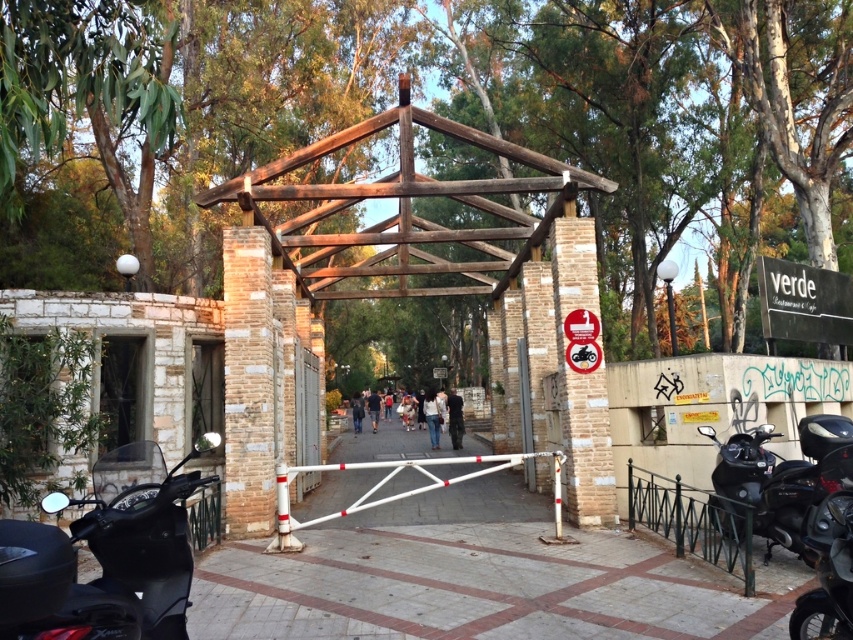
Does black matte motorcycle at lower left have a lesser height compared to shiny black motorcycle at lower right?

No, black matte motorcycle at lower left is not shorter than shiny black motorcycle at lower right.

Does black matte motorcycle at lower left have a larger size compared to shiny black motorcycle at lower right?

Yes, black matte motorcycle at lower left is bigger than shiny black motorcycle at lower right.

Image resolution: width=853 pixels, height=640 pixels. What do you see at coordinates (103, 560) in the screenshot?
I see `black matte motorcycle at lower left` at bounding box center [103, 560].

The width and height of the screenshot is (853, 640). In order to click on black matte motorcycle at lower left in this screenshot , I will do `click(103, 560)`.

Can you confirm if black matte motorcycle at lower left is taller than black glossy motorcycle at lower right?

In fact, black matte motorcycle at lower left may be shorter than black glossy motorcycle at lower right.

Who is higher up, black matte motorcycle at lower left or black glossy motorcycle at lower right?

Positioned higher is black matte motorcycle at lower left.

I want to click on black matte motorcycle at lower left, so click(103, 560).

Does point (799, 524) come farther from viewer compared to point (811, 534)?

Yes, point (799, 524) is behind point (811, 534).

Based on the photo, is black glossy motorcycle at lower right above shiny black motorcycle at lower right?

Indeed, black glossy motorcycle at lower right is positioned over shiny black motorcycle at lower right.

Does point (799, 481) come farther from viewer compared to point (815, 600)?

Yes, it is.

Where is `black glossy motorcycle at lower right`? The image size is (853, 640). black glossy motorcycle at lower right is located at coordinates [782, 476].